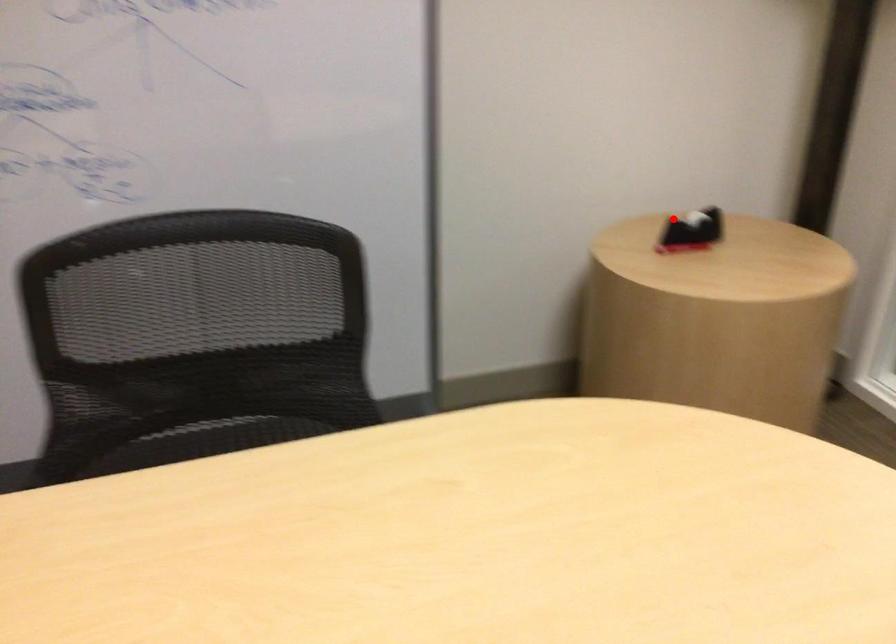
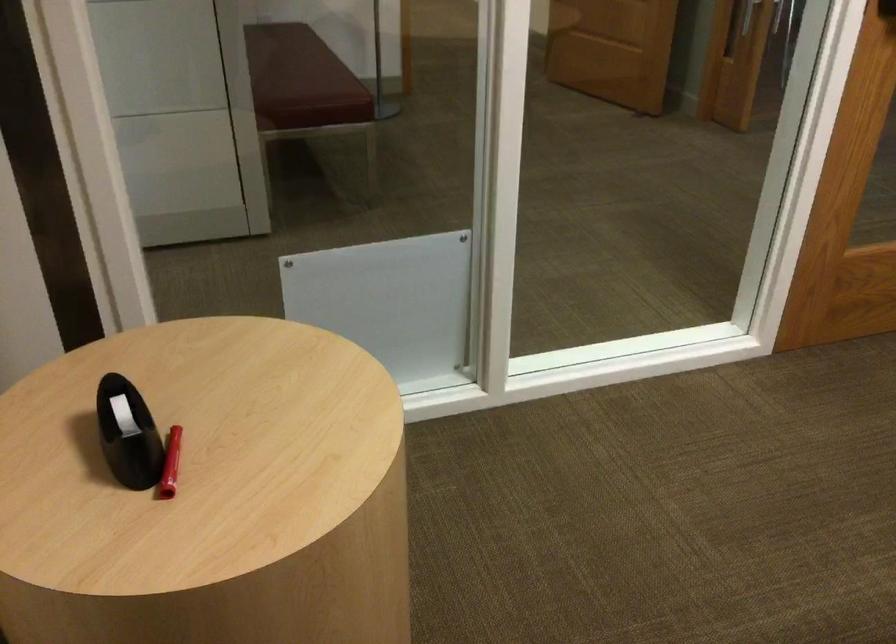
In the second image, find the point that corresponds to the highlighted location in the first image.

(127, 433)